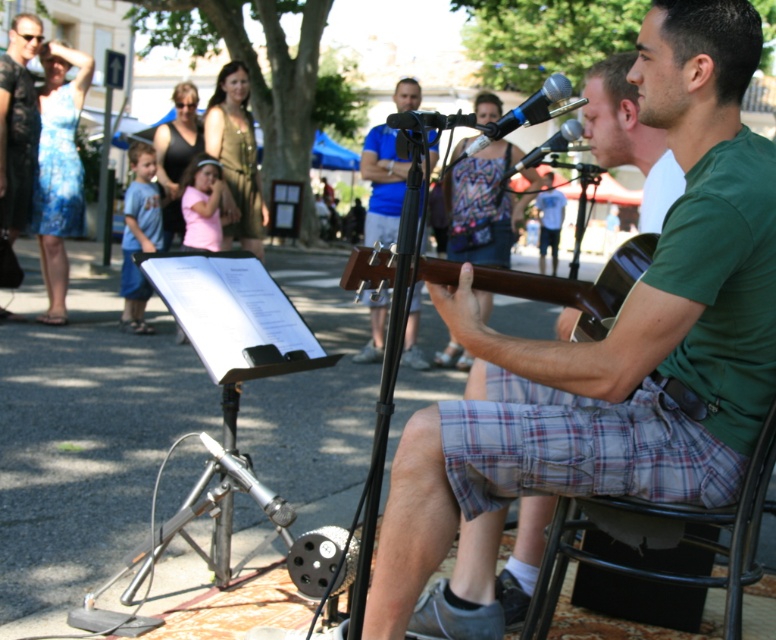
Looking at this image, can you confirm if brown wood guitar at center is smaller than blue metallic microphone at center?

Incorrect, brown wood guitar at center is not smaller in size than blue metallic microphone at center.

Between point (639, 237) and point (466, 148), which one is positioned behind?

Positioned behind is point (466, 148).

The height and width of the screenshot is (640, 776). I want to click on brown wood guitar at center, so click(x=577, y=284).

Is blue fabric guitar at center above blue metallic microphone at center?

Indeed, blue fabric guitar at center is positioned over blue metallic microphone at center.

Looking at this image, can you confirm if blue fabric guitar at center is smaller than blue metallic microphone at center?

Actually, blue fabric guitar at center might be larger than blue metallic microphone at center.

The height and width of the screenshot is (640, 776). What are the coordinates of `blue fabric guitar at center` in the screenshot? It's located at (383, 182).

Identify the location of blue fabric guitar at center. (383, 182).

Between wooden acoustic guitar at center and black matte microphone at center, which one is positioned higher?

black matte microphone at center is higher up.

Who is positioned more to the right, wooden acoustic guitar at center or black matte microphone at center?

Positioned to the right is wooden acoustic guitar at center.

Is point (556, 371) farther from camera compared to point (424, 125)?

No, (556, 371) is in front of (424, 125).

You are a GUI agent. You are given a task and a screenshot of the screen. Output one action in this format:
    pyautogui.click(x=<x>, y=<y>)
    Task: Click on the wooden acoustic guitar at center
    The height and width of the screenshot is (640, 776).
    Given the screenshot: What is the action you would take?
    pyautogui.click(x=605, y=355)